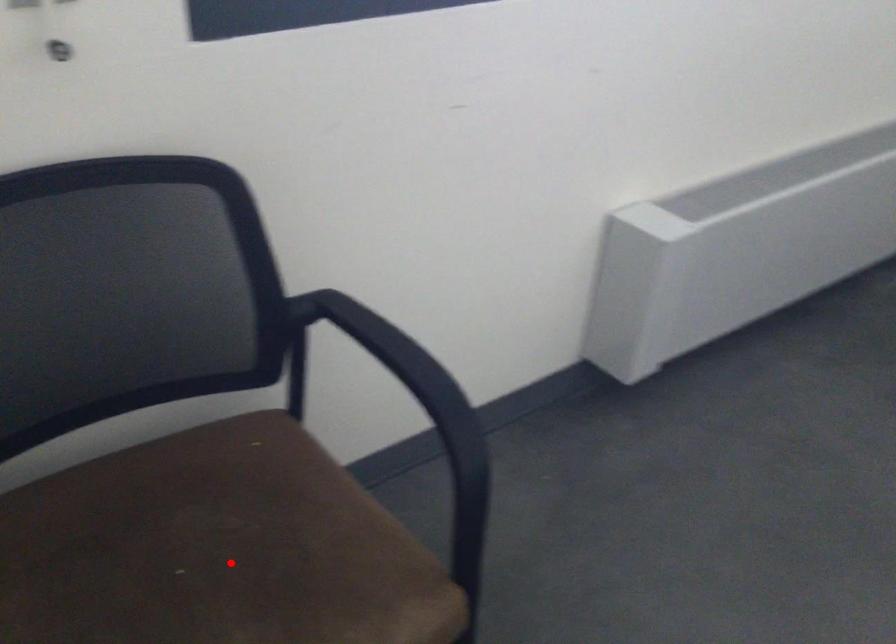
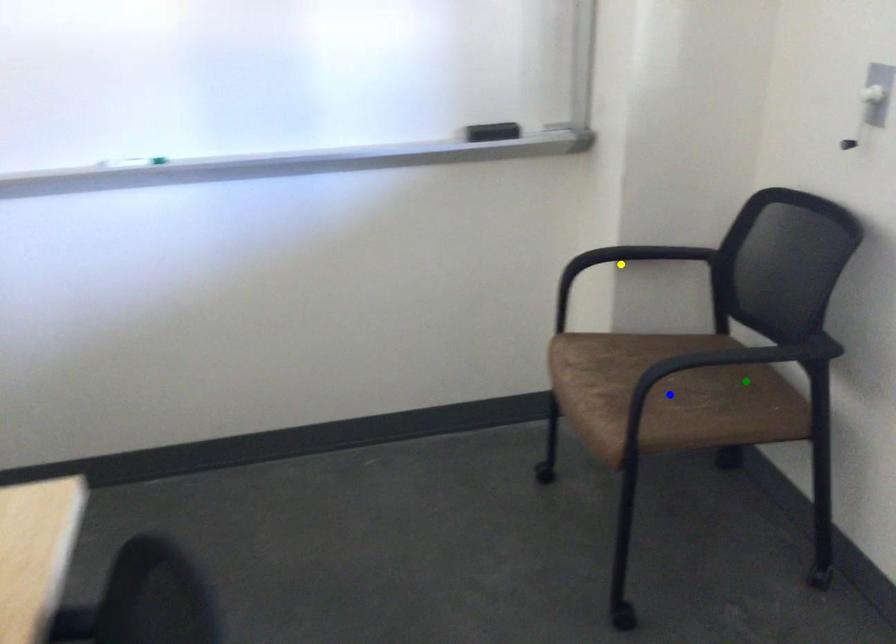
Question: I am providing you with two images of the same scene from different viewpoints. A red point is marked on the first image. You are given multiple points on the second image. Which point in image 2 represents the same 3d spot as the red point in image 1?

Choices:
 (A) blue point
 (B) green point
 (C) yellow point

Answer: (A)